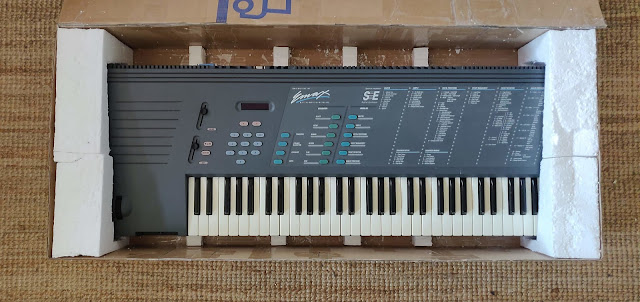
Locate an element on the screen. keyboard is located at coordinates pyautogui.click(x=386, y=138).